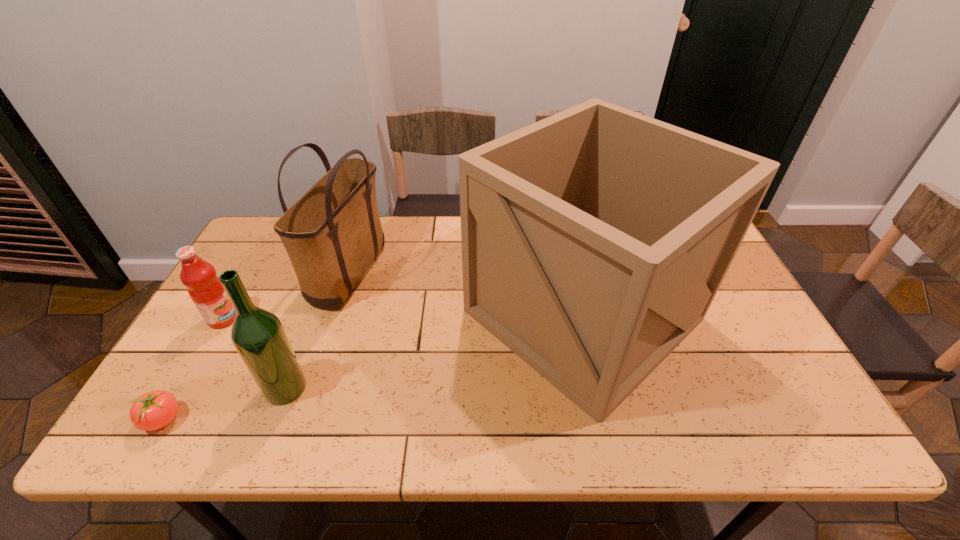
Where is `blank space located 0.400m on the right of the shortest object`? Image resolution: width=960 pixels, height=540 pixels. blank space located 0.400m on the right of the shortest object is located at coordinates (361, 420).

This screenshot has height=540, width=960. Find the location of `box at the far edge`. box at the far edge is located at coordinates (594, 241).

You are a GUI agent. You are given a task and a screenshot of the screen. Output one action in this format:
    pyautogui.click(x=<x>, y=<y>)
    Task: Click on the tote bag present at the far edge
    This screenshot has height=540, width=960.
    Given the screenshot: What is the action you would take?
    pyautogui.click(x=332, y=234)

Locate an element on the screen. The height and width of the screenshot is (540, 960). box present at the near edge is located at coordinates (x=594, y=241).

Identify the location of tomato at the near edge. (156, 409).

Where is `fruit juice located in the left edge section of the desktop`? fruit juice located in the left edge section of the desktop is located at coordinates (204, 287).

At what (x,y) coordinates should I click in order to perform the action: click on tomato located in the left edge section of the desktop. Please return your answer as a coordinate pair (x, y). Image resolution: width=960 pixels, height=540 pixels. Looking at the image, I should click on (156, 409).

You are a GUI agent. You are given a task and a screenshot of the screen. Output one action in this format:
    pyautogui.click(x=<x>, y=<y>)
    Task: Click on the object positioned at the right edge
    The width and height of the screenshot is (960, 540).
    Given the screenshot: What is the action you would take?
    pyautogui.click(x=594, y=241)

This screenshot has height=540, width=960. In order to click on object present at the near left corner in this screenshot , I will do `click(156, 409)`.

You are a GUI agent. You are given a task and a screenshot of the screen. Output one action in this format:
    pyautogui.click(x=<x>, y=<y>)
    Task: Click on the object that is at the far right corner
    
    Given the screenshot: What is the action you would take?
    pyautogui.click(x=594, y=241)